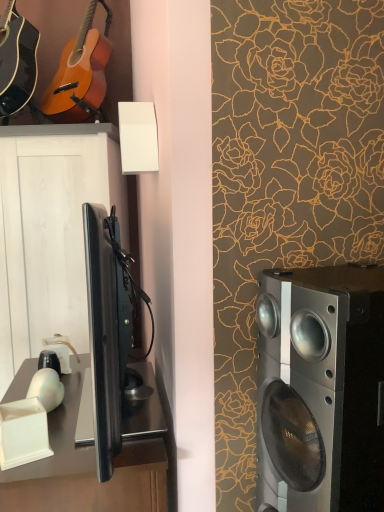
Question: Does silver metallic speaker at right have a greater width compared to satin black desk at lower left?

Choices:
 (A) no
 (B) yes

Answer: (A)

Question: Can you confirm if silver metallic speaker at right is taller than satin black desk at lower left?

Choices:
 (A) yes
 (B) no

Answer: (B)

Question: Does silver metallic speaker at right have a lesser height compared to satin black desk at lower left?

Choices:
 (A) no
 (B) yes

Answer: (B)

Question: Can satin black desk at lower left be found inside silver metallic speaker at right?

Choices:
 (A) no
 (B) yes

Answer: (A)

Question: Is silver metallic speaker at right further to the viewer compared to satin black desk at lower left?

Choices:
 (A) no
 (B) yes

Answer: (A)

Question: Considering the relative positions of matte black acoustic guitar at upper left, which is counted as the second guitar, starting from the right, and black glossy cabinet at left in the image provided, is matte black acoustic guitar at upper left, which is counted as the second guitar, starting from the right, to the left or to the right of black glossy cabinet at left?

Choices:
 (A) right
 (B) left

Answer: (B)

Question: Based on their sizes in the image, would you say matte black acoustic guitar at upper left, which is counted as the second guitar, starting from the right, is bigger or smaller than black glossy cabinet at left?

Choices:
 (A) small
 (B) big

Answer: (A)

Question: Is matte black acoustic guitar at upper left, which is counted as the second guitar, starting from the right, wider or thinner than black glossy cabinet at left?

Choices:
 (A) wide
 (B) thin

Answer: (B)

Question: Is point (29, 32) positioned closer to the camera than point (67, 150)?

Choices:
 (A) farther
 (B) closer

Answer: (A)

Question: Is matte orange wood guitar at upper left, which is the 1th guitar from right to left, spatially inside satin black desk at lower left, or outside of it?

Choices:
 (A) outside
 (B) inside

Answer: (A)

Question: Looking at their shapes, would you say matte orange wood guitar at upper left, the 2th guitar positioned from the left, is wider or thinner than satin black desk at lower left?

Choices:
 (A) thin
 (B) wide

Answer: (A)

Question: From a real-world perspective, relative to satin black desk at lower left, is matte orange wood guitar at upper left, which is the 1th guitar from right to left, vertically above or below?

Choices:
 (A) below
 (B) above

Answer: (B)

Question: Looking at the image, does matte orange wood guitar at upper left, the 2th guitar positioned from the left, seem bigger or smaller compared to satin black desk at lower left?

Choices:
 (A) small
 (B) big

Answer: (A)

Question: From the image's perspective, is matte black acoustic guitar at upper left, which is counted as the second guitar, starting from the right, located above or below matte orange wood guitar at upper left, the 2th guitar positioned from the left?

Choices:
 (A) below
 (B) above

Answer: (A)

Question: Considering the positions of point (29, 65) and point (87, 70), is point (29, 65) closer or farther from the camera than point (87, 70)?

Choices:
 (A) farther
 (B) closer

Answer: (B)